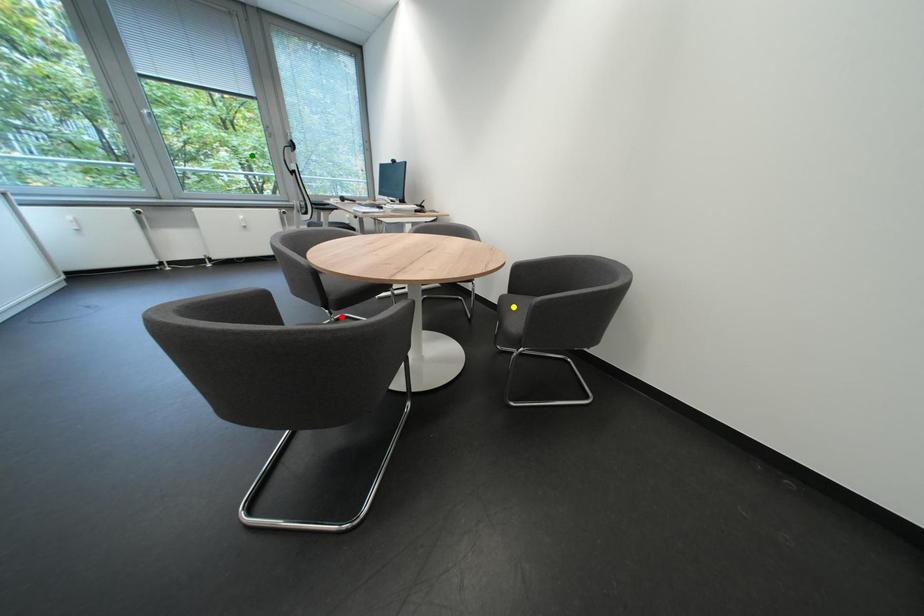
Order these from farthest to nearest:
1. yellow point
2. green point
3. red point

→ green point < red point < yellow point